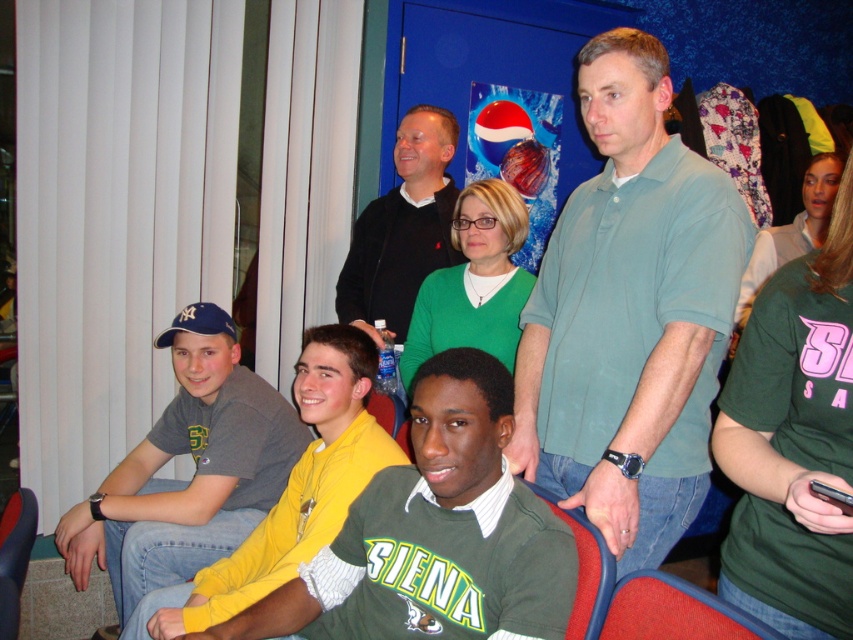
Question: Is red fabric chair at lower right behind red fabric chair at lower center?

Choices:
 (A) yes
 (B) no

Answer: (B)

Question: Which point appears closest to the camera in this image?

Choices:
 (A) (311, 515)
 (B) (693, 273)
 (C) (704, 595)

Answer: (C)

Question: Is green jersey at center positioned at the back of red fabric chair at lower center?

Choices:
 (A) yes
 (B) no

Answer: (B)

Question: Which object is the farthest from the gray cotton t-shirt at left?

Choices:
 (A) green jersey at center
 (B) red fabric chair at lower right
 (C) green cotton polo shirt at center
 (D) red fabric chair at lower center

Answer: (B)

Question: Can you confirm if red fabric chair at lower right is thinner than red fabric chair at lower center?

Choices:
 (A) no
 (B) yes

Answer: (A)

Question: Which point is closer to the camera?

Choices:
 (A) red fabric chair at lower right
 (B) green jersey at center
 (C) black matte jacket at upper center

Answer: (A)